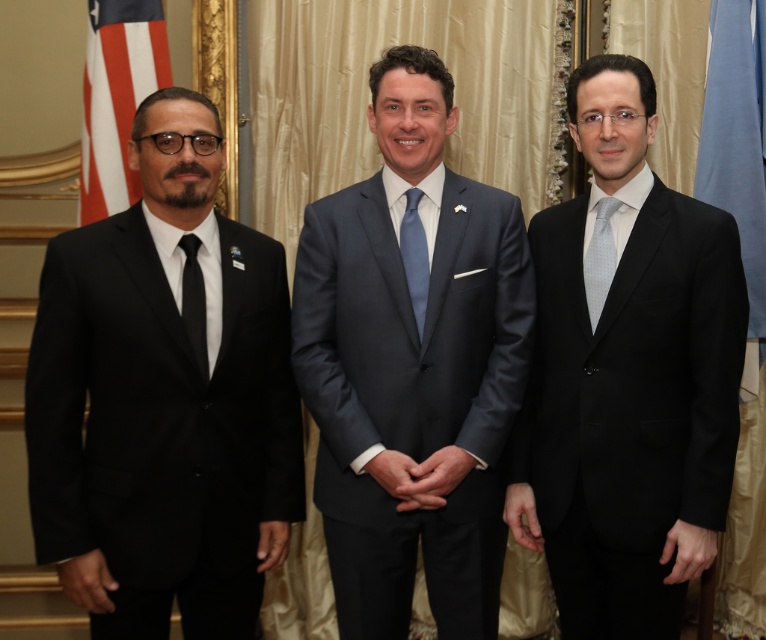
Which is below, matte black suit at left or light blue dotted tie at center?

matte black suit at left

Can you confirm if matte black suit at left is taller than light blue dotted tie at center?

Yes, matte black suit at left is taller than light blue dotted tie at center.

This screenshot has height=640, width=766. I want to click on matte black suit at left, so click(x=162, y=401).

Image resolution: width=766 pixels, height=640 pixels. In order to click on matte black suit at left in this screenshot , I will do `click(162, 401)`.

Which is behind, point (761, 97) or point (93, 35)?

The point (93, 35) is behind.

Is blue fabric flag at right to the left of american flag at left from the viewer's perspective?

Incorrect, blue fabric flag at right is not on the left side of american flag at left.

The width and height of the screenshot is (766, 640). Describe the element at coordinates (737, 138) in the screenshot. I see `blue fabric flag at right` at that location.

This screenshot has width=766, height=640. I want to click on blue fabric flag at right, so click(737, 138).

Can you confirm if light blue dotted tie at center is positioned to the left of light blue silk tie at center?

In fact, light blue dotted tie at center is to the right of light blue silk tie at center.

The image size is (766, 640). I want to click on light blue dotted tie at center, so (598, 259).

What are the coordinates of `light blue dotted tie at center` in the screenshot? It's located at (598, 259).